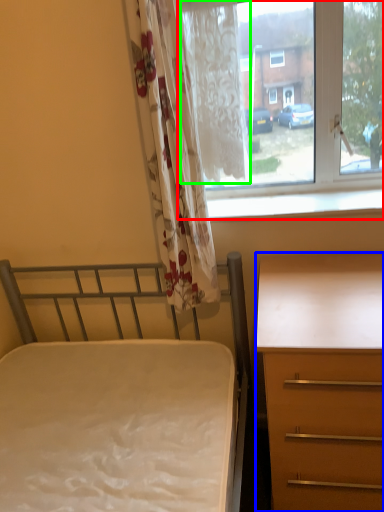
Question: Which object is positioned farthest from window (highlighted by a red box)? Select from desk (highlighted by a blue box) and curtain (highlighted by a green box).

Choices:
 (A) desk
 (B) curtain

Answer: (A)